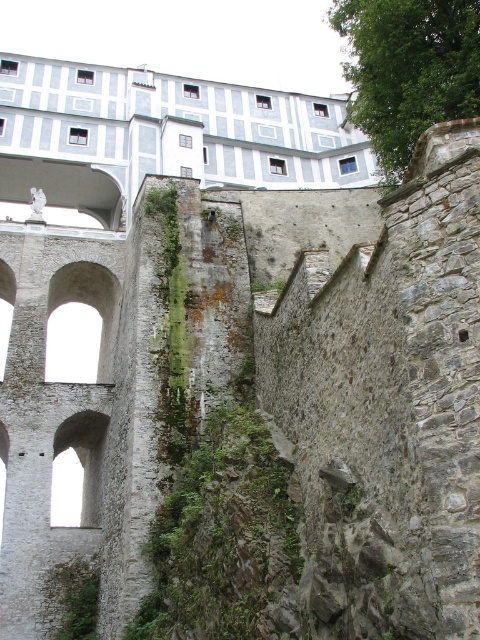
Does green mossy wall at center have a smaller size compared to green leafy tree at upper right?

Yes, green mossy wall at center is smaller than green leafy tree at upper right.

Where is `green mossy wall at center`? green mossy wall at center is located at coordinates (226, 536).

Where is `green mossy wall at center`? This screenshot has width=480, height=640. green mossy wall at center is located at coordinates (226, 536).